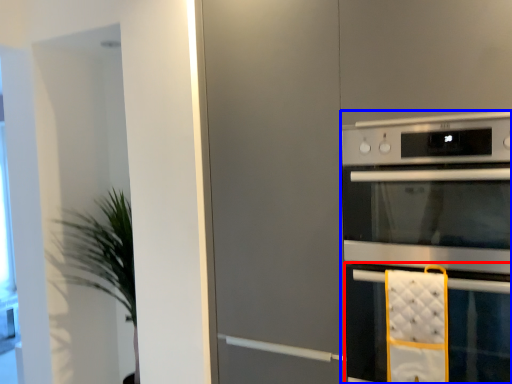
Question: Among these objects, which one is nearest to the camera, oven (highlighted by a red box) or home appliance (highlighted by a blue box)?

Choices:
 (A) oven
 (B) home appliance

Answer: (B)